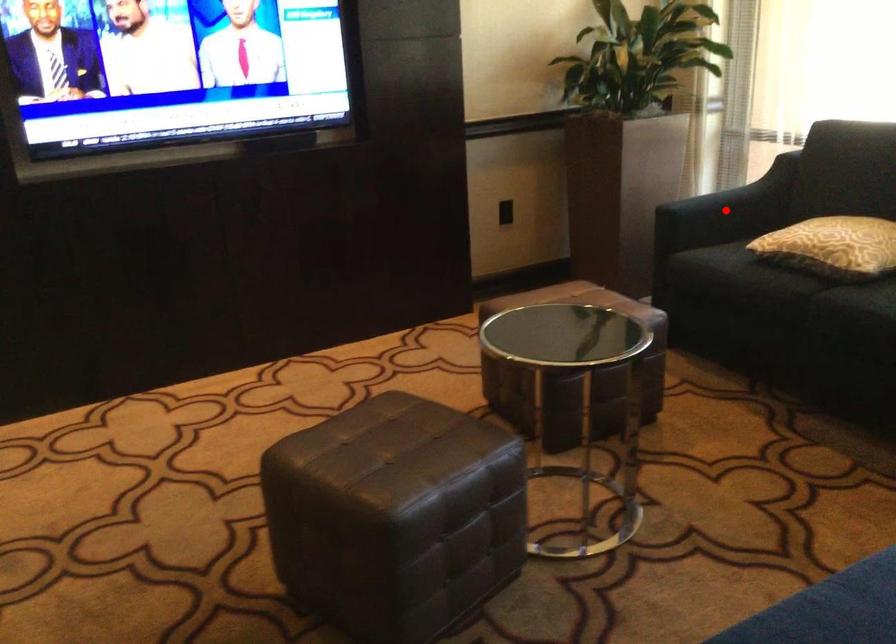
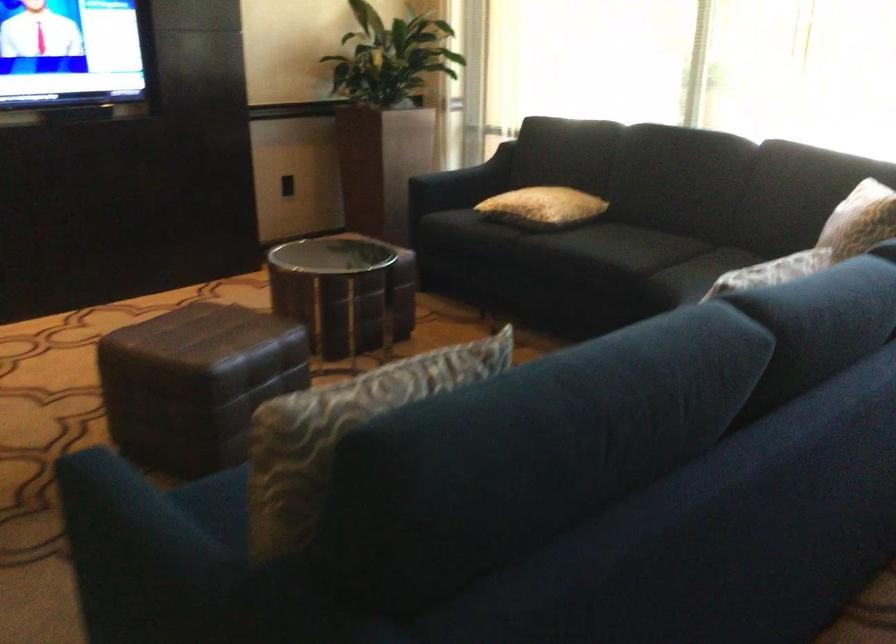
Question: I am providing you with two images of the same scene from different viewpoints. A red point is shown in image1. For the corresponding object point in image2, is it positioned nearer or farther from the camera?

Choices:
 (A) Nearer
 (B) Farther

Answer: (B)